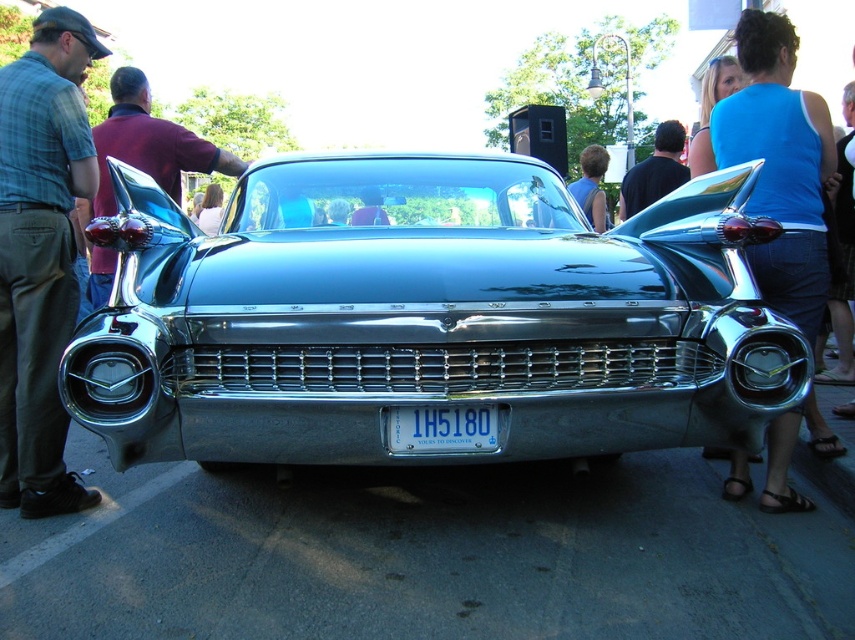
Can you confirm if shiny chrome car at center is thinner than black fabric shirt at center?

No.

Where is `shiny chrome car at center`? Image resolution: width=855 pixels, height=640 pixels. shiny chrome car at center is located at coordinates (428, 316).

Where is `shiny chrome car at center`? This screenshot has width=855, height=640. shiny chrome car at center is located at coordinates (428, 316).

Who is more distant from viewer, (167, 186) or (634, 211)?

The point (634, 211) is more distant.

Is maroon fabric shirt at left behind black fabric shirt at center?

No.

The image size is (855, 640). I want to click on maroon fabric shirt at left, so click(x=149, y=144).

This screenshot has height=640, width=855. Describe the element at coordinates (428, 316) in the screenshot. I see `shiny chrome car at center` at that location.

Can you confirm if shiny chrome car at center is bigger than blue metallic license plate at center?

Yes.

What do you see at coordinates (428, 316) in the screenshot? The image size is (855, 640). I see `shiny chrome car at center` at bounding box center [428, 316].

The width and height of the screenshot is (855, 640). I want to click on shiny chrome car at center, so click(428, 316).